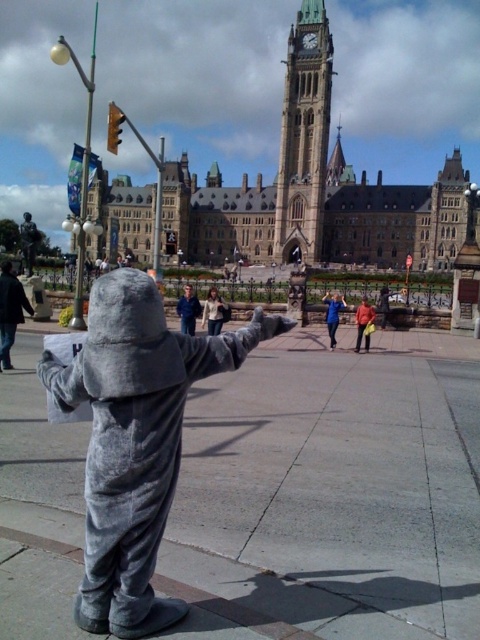
You are a photographer standing in front of the historic building with a camera. You want to take a photo that includes both the light brown leather jacket at center and the red jacket at center. Given that your camera has a maximum focus range of 60 feet, will you be able to capture both subjects in focus without moving closer?

The distance between the light brown leather jacket at center and the red jacket at center is 66.58 feet. Since the camera can only focus up to 60 feet, it won t be able to capture both subjects in focus simultaneously without moving closer.

You are a photographer trying to take a photo of the red jacket at center and the light brown leather jacket at center. Which jacket is blocking the view of the other?

The light brown leather jacket at center is blocking the view of the red jacket at center because the red jacket at center is behind it.

You are a photographer trying to capture both the dark gray plush costume at left and the red jacket at center in a single frame. Which object should you focus on first to ensure both are in the frame?

The dark gray plush costume at left is much taller than the red jacket at center, so you should focus on the taller object first to ensure both are in the frame.